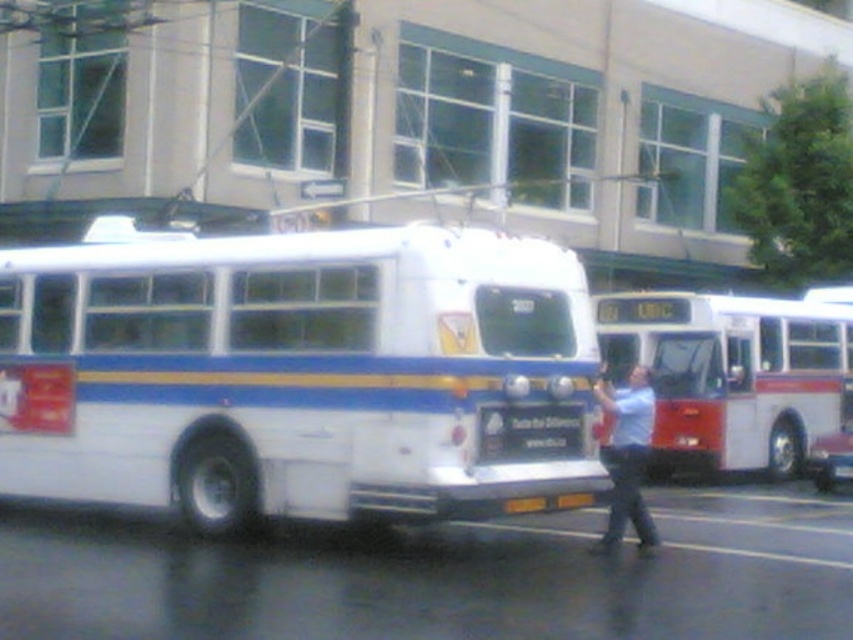
You are a delivery person who needs to place a new sign that is 1 meter wide between the white matte bus at center and the black plastic sign at center. Is there enough space between them to fit the new sign?

The white matte bus at center and black plastic sign at center are 1.25 meters apart from each other. Since the new sign is 1 meter wide, there is enough space to fit it between them.

You are a bus driver who needs to check the destination sign. You see the red matte bus at center and the black plastic sign at center. Which object is positioned higher in the image?

The red matte bus at center is above the black plastic sign at center, so the red matte bus at center is positioned higher in the image.

You are a bus driver who needs to park your bus in a space that can only accommodate buses shorter than 12 meters. You are currently driving the white matte bus at center and the red matte bus at center. Which bus should you choose to park in this space?

The white matte bus at center is shorter than the red matte bus at center, so you should choose the white matte bus at center to park in the space since it is shorter than 12 meters.